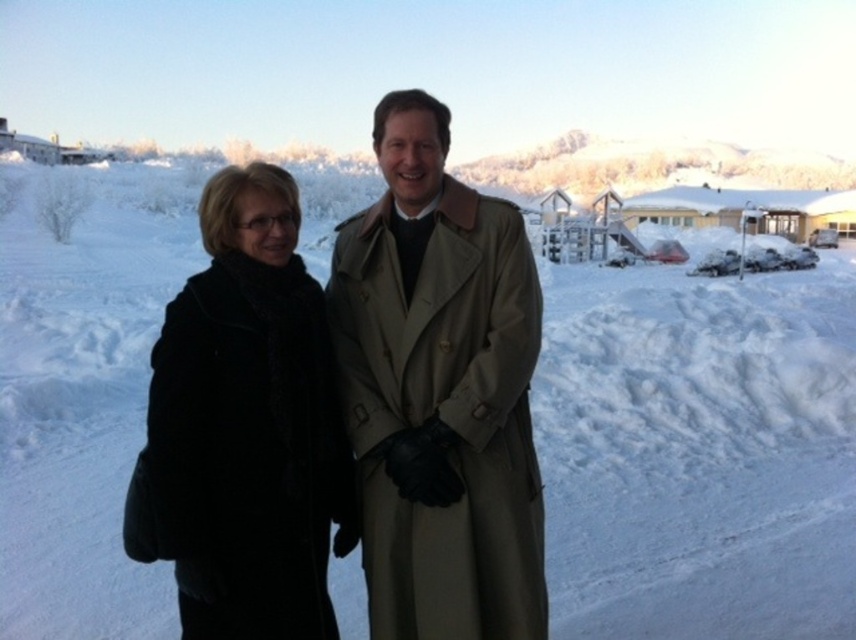
You are a photographer trying to arrange two models wearing black wool coats for a photo shoot in a snowy landscape. The scene requires the smaller coat to be positioned closer to the camera to emphasize its size. Given the current setup where the black wool coat at center and the black wool coat at left are present, which coat should you move closer to the camera?

The black wool coat at center has a smaller size compared to the black wool coat at left, so you should move the black wool coat at center closer to the camera to emphasize its size.

You are a photographer trying to position a subject in the center of the image. The black wool coat at left is currently at position coordinates 0.670, 0.287. What direction should the subject move to reach the center?

The black wool coat at left is located at coordinates 0.670 on the x and 0.287 on the y. To reach the center of the image, the subject should move to the left and upwards since the center is at (428,320). The current x is higher than 0.5, so moving left, and the y is lower than 0.5, so moving up.